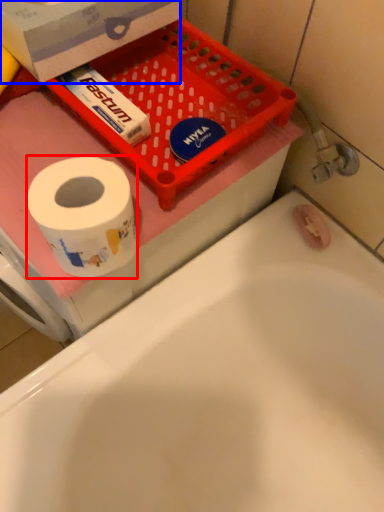
Question: Which object appears farthest to the camera in this image, toilet paper (highlighted by a red box) or box (highlighted by a blue box)?

Choices:
 (A) toilet paper
 (B) box

Answer: (B)